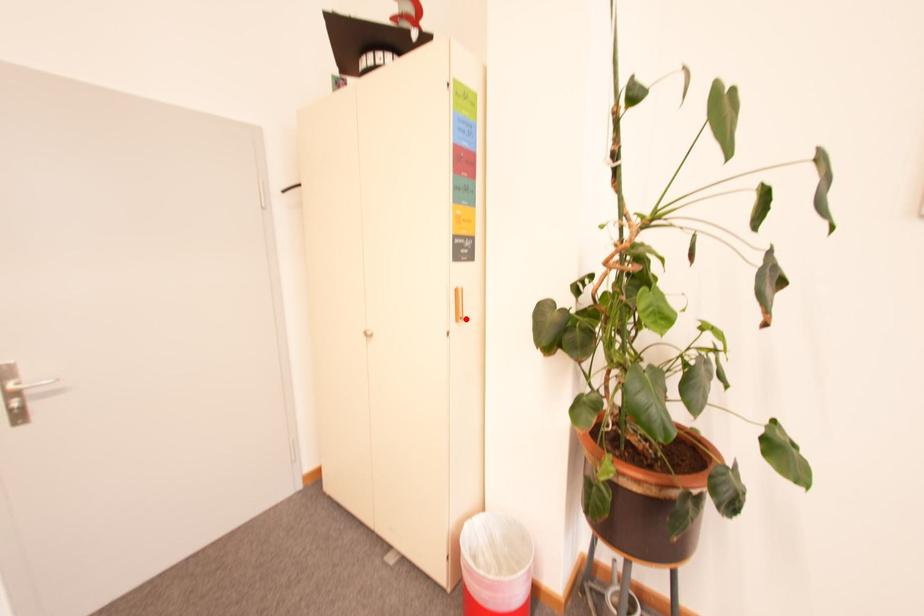
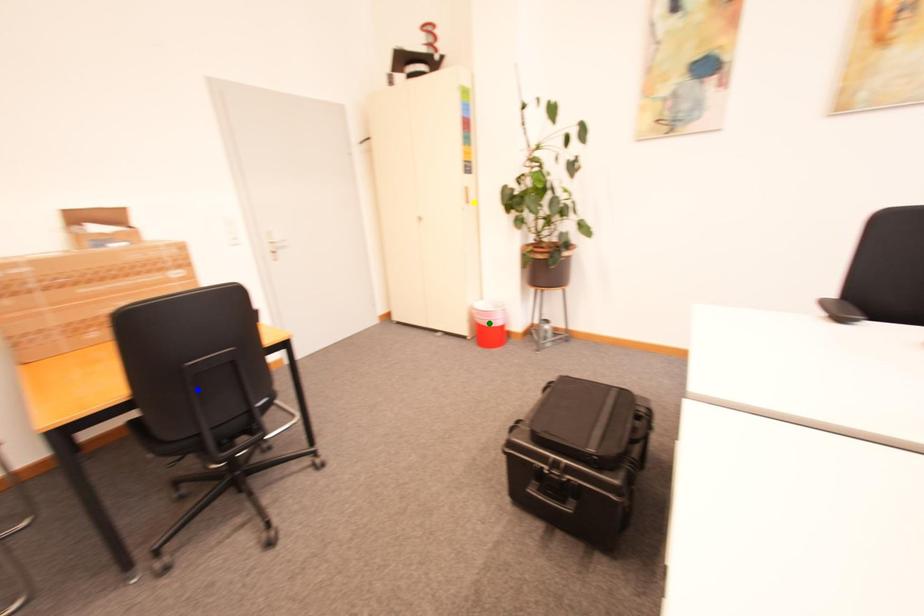
Question: I am providing you with two images of the same scene from different viewpoints. A red point is marked on the first image. You are given multiple points on the second image. Can you choose the point in image 2 that corresponds to the point in image 1?

Choices:
 (A) blue point
 (B) green point
 (C) yellow point

Answer: (C)